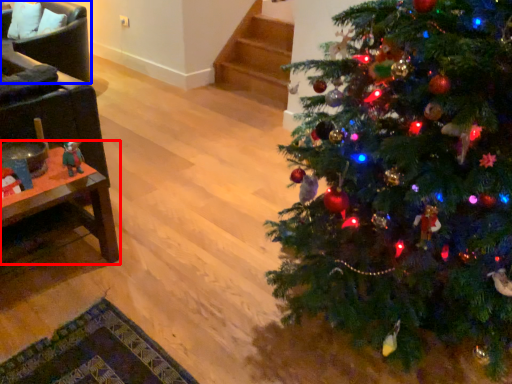
Question: Which of the following is the farthest to the observer, table (highlighted by a red box) or armchair (highlighted by a blue box)?

Choices:
 (A) table
 (B) armchair

Answer: (B)